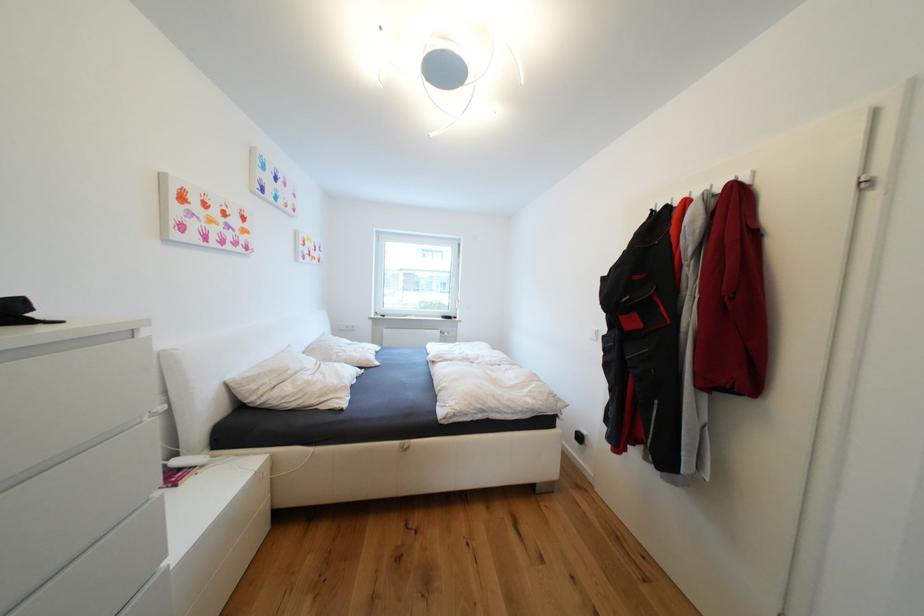
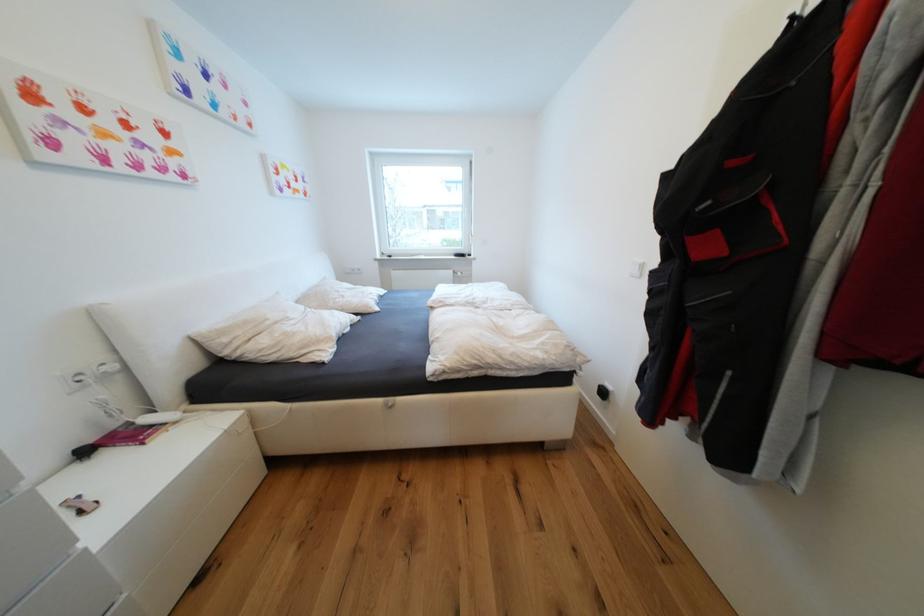
What movement of the cameraman would produce the second image?

The movement direction of the cameraman is right, forward.